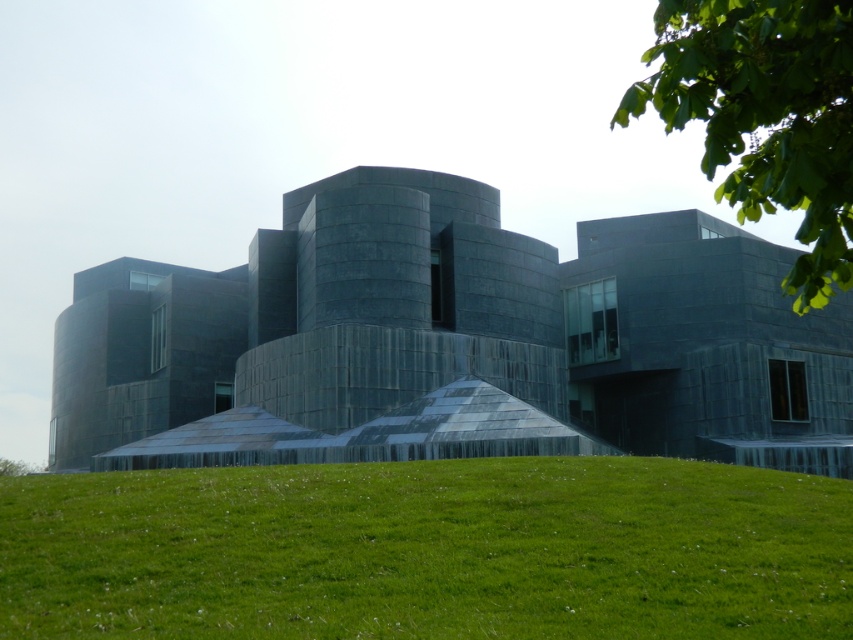
Looking at the dark gray stone building at center and the green leafy tree at upper right, which object is positioned more to the left side of the image?

The dark gray stone building at center is positioned to the left of the green leafy tree at upper right, so it is more to the left side of the image.

You are a landscape architect planning to plant a row of trees between the dark gray stone building at center and the green grass at lower center. Considering their sizes, which area would require more space for the trees to grow comfortably?

The dark gray stone building at center has a larger width than the green grass at lower center, so the area near the dark gray stone building at center would require more space for the trees to grow comfortably.